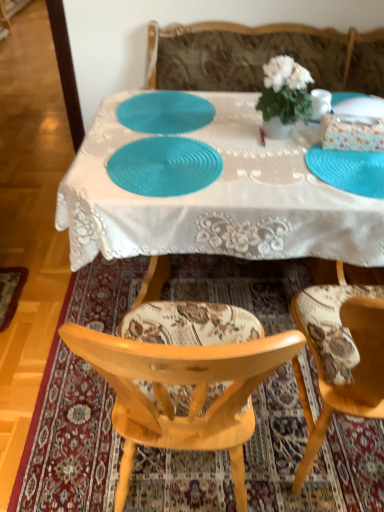
This screenshot has width=384, height=512. In order to click on vacant space positioned to the left of blue rubber placemat at lower right, the 3th plate from the left in this screenshot , I will do `click(263, 168)`.